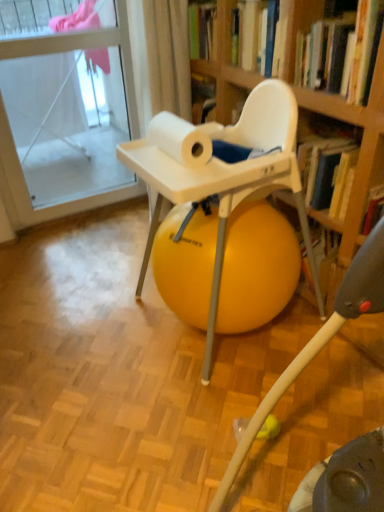
Question: Are white matte paper towel at upper center and yellow rubber ball at center beside each other?

Choices:
 (A) yes
 (B) no

Answer: (B)

Question: Is yellow rubber ball at center completely or partially inside white matte paper towel at upper center?

Choices:
 (A) no
 (B) yes

Answer: (A)

Question: Is white matte paper towel at upper center thinner than yellow rubber ball at center?

Choices:
 (A) yes
 (B) no

Answer: (A)

Question: From a real-world perspective, is white matte paper towel at upper center over yellow rubber ball at center?

Choices:
 (A) yes
 (B) no

Answer: (A)

Question: Does white matte paper towel at upper center appear on the left side of yellow rubber ball at center?

Choices:
 (A) no
 (B) yes

Answer: (B)

Question: Considering the positions of yellow rubber ball at center and white matte paper towel at upper center in the image, is yellow rubber ball at center bigger or smaller than white matte paper towel at upper center?

Choices:
 (A) big
 (B) small

Answer: (A)

Question: In terms of height, does yellow rubber ball at center look taller or shorter compared to white matte paper towel at upper center?

Choices:
 (A) short
 (B) tall

Answer: (B)

Question: From the image's perspective, is yellow rubber ball at center above or below white matte paper towel at upper center?

Choices:
 (A) below
 (B) above

Answer: (A)

Question: From a real-world perspective, is yellow rubber ball at center positioned above or below white matte paper towel at upper center?

Choices:
 (A) above
 (B) below

Answer: (B)

Question: Is transparent glass door at upper left to the left or to the right of hardcover book at upper right in the image?

Choices:
 (A) left
 (B) right

Answer: (A)

Question: From a real-world perspective, is transparent glass door at upper left positioned above or below hardcover book at upper right?

Choices:
 (A) above
 (B) below

Answer: (B)

Question: Does point (56, 109) appear closer or farther from the camera than point (357, 74)?

Choices:
 (A) closer
 (B) farther

Answer: (B)

Question: Based on their sizes in the image, would you say transparent glass door at upper left is bigger or smaller than hardcover book at upper right?

Choices:
 (A) small
 (B) big

Answer: (B)

Question: In the image, is white matte paper towel at upper center positioned in front of or behind hardcover book at upper right?

Choices:
 (A) front
 (B) behind

Answer: (B)

Question: Considering the positions of white matte paper towel at upper center and hardcover book at upper right in the image, is white matte paper towel at upper center taller or shorter than hardcover book at upper right?

Choices:
 (A) short
 (B) tall

Answer: (A)